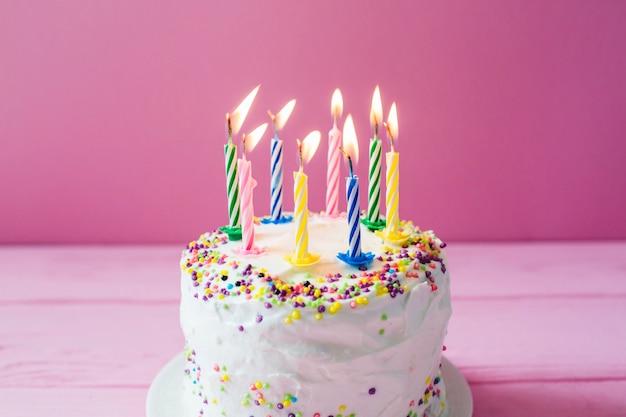
Where is `candle flames`? The width and height of the screenshot is (626, 417). candle flames is located at coordinates (255, 135), (243, 108), (285, 114), (313, 142), (336, 101), (351, 145), (376, 105), (392, 121).